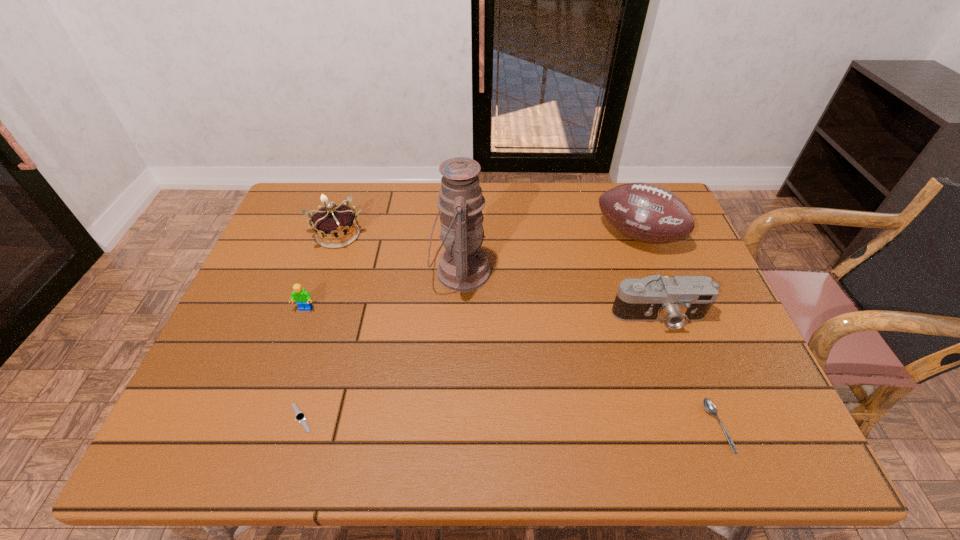
Identify the location of free space located 0.280m on the front of the crown. The height and width of the screenshot is (540, 960). (305, 330).

Where is `vacant space positioned 0.210m on the lens of the camera`? The height and width of the screenshot is (540, 960). vacant space positioned 0.210m on the lens of the camera is located at coordinates (694, 414).

What are the coordinates of `vacant space situated 0.080m on the face of the third shortest object` in the screenshot? It's located at (295, 339).

Where is `free space located on the left of the soupspoon`? Image resolution: width=960 pixels, height=540 pixels. free space located on the left of the soupspoon is located at coordinates (665, 426).

Where is `free space located on the back of the shortest object`? free space located on the back of the shortest object is located at coordinates (335, 303).

You are a GUI agent. You are given a task and a screenshot of the screen. Output one action in this format:
    pyautogui.click(x=<x>, y=<y>)
    Task: Click on the football (American) located in the far edge section of the desktop
    
    Given the screenshot: What is the action you would take?
    pyautogui.click(x=644, y=212)

Identify the location of crown present at the far edge. This screenshot has height=540, width=960. (335, 226).

Locate an element on the screen. The image size is (960, 540). soupspoon situated at the near edge is located at coordinates (709, 406).

This screenshot has width=960, height=540. Identify the location of watch present at the near edge. (300, 416).

Where is `crown present at the left edge`? The width and height of the screenshot is (960, 540). crown present at the left edge is located at coordinates (335, 226).